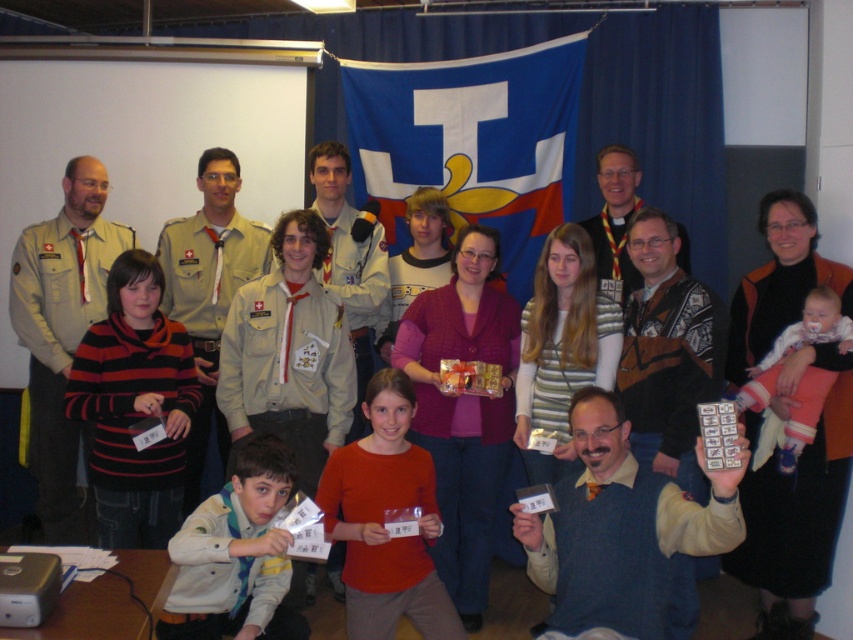
Can you confirm if matte khaki shirt at center is taller than khaki uniform at center?

Correct, matte khaki shirt at center is much taller as khaki uniform at center.

Can you confirm if matte khaki shirt at center is thinner than khaki uniform at center?

No.

Is point (41, 394) closer to viewer compared to point (196, 500)?

Yes.

Where is `matte khaki shirt at center`? matte khaki shirt at center is located at coordinates (61, 332).

Between blue fabric flag at upper center and blue sweater at center, which one has more height?

blue fabric flag at upper center

What do you see at coordinates (469, 141) in the screenshot? The height and width of the screenshot is (640, 853). I see `blue fabric flag at upper center` at bounding box center [469, 141].

In order to click on blue fabric flag at upper center in this screenshot , I will do `click(469, 141)`.

Is matte khaki shirt at center thinner than light brown uniform at center?

No, matte khaki shirt at center is not thinner than light brown uniform at center.

Which is behind, point (49, 243) or point (351, 253)?

Positioned behind is point (351, 253).

Describe the element at coordinates (61, 332) in the screenshot. I see `matte khaki shirt at center` at that location.

You are a GUI agent. You are given a task and a screenshot of the screen. Output one action in this format:
    pyautogui.click(x=<x>, y=<y>)
    Task: Click on the matte khaki shirt at center
    The height and width of the screenshot is (640, 853).
    Given the screenshot: What is the action you would take?
    pyautogui.click(x=61, y=332)